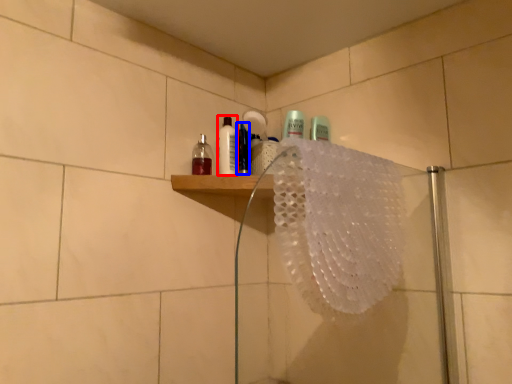
Question: Among these objects, which one is farthest to the camera, mouthwash (highlighted by a red box) or mouthwash (highlighted by a blue box)?

Choices:
 (A) mouthwash
 (B) mouthwash

Answer: (A)